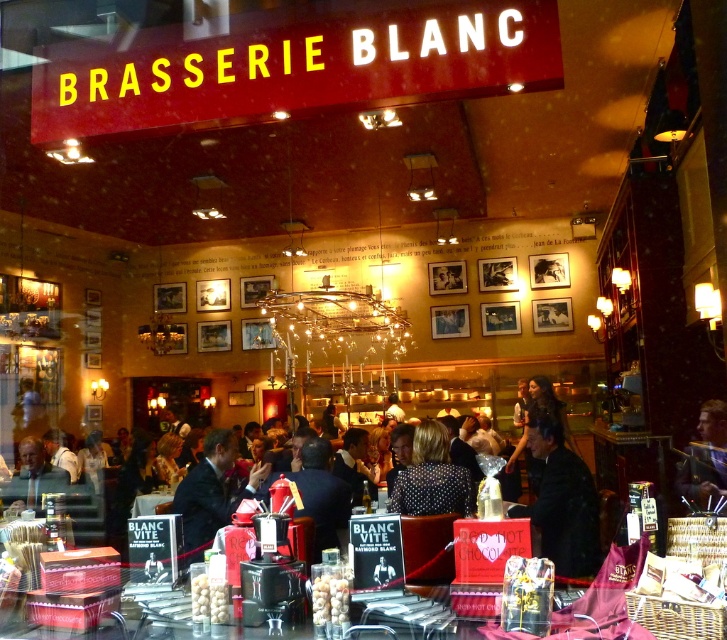
Question: Among these points, which one is farthest from the camera?

Choices:
 (A) (590, 605)
 (B) (595, 499)

Answer: (B)

Question: Does translucent glass table at center have a lesser width compared to black dotted dress at center?

Choices:
 (A) yes
 (B) no

Answer: (B)

Question: Considering the relative positions of dark blue suit at center and smooth leather jacket at lower right in the image provided, where is dark blue suit at center located with respect to smooth leather jacket at lower right?

Choices:
 (A) above
 (B) below

Answer: (B)

Question: Is black matte jacket at center to the right of dark suit at center from the viewer's perspective?

Choices:
 (A) no
 (B) yes

Answer: (B)

Question: Considering the real-world distances, which object is closest to the dark suit at center?

Choices:
 (A) translucent glass table at center
 (B) matte black suit at lower left
 (C) dark blue suit at center
 (D) black dotted dress at center

Answer: (C)

Question: Which object appears farthest from the camera in this image?

Choices:
 (A) matte black suit at lower left
 (B) translucent glass table at center

Answer: (A)